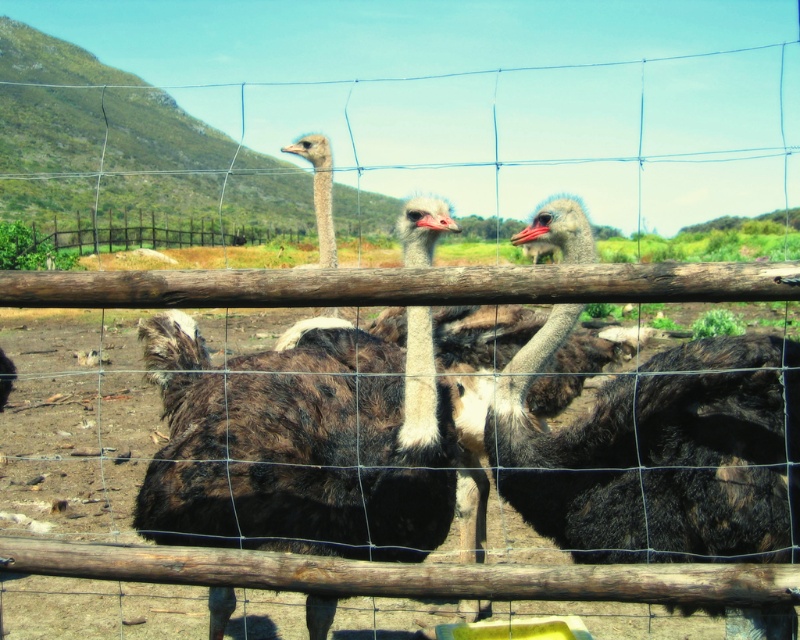
Question: Among these points, which one is nearest to the camera?

Choices:
 (A) (306, 468)
 (B) (516, 458)

Answer: (A)

Question: Can you confirm if dark brown feathered ostrich at center is positioned above dark brown feathers at center?

Choices:
 (A) yes
 (B) no

Answer: (B)

Question: Which point is farther from the camera taking this photo?

Choices:
 (A) pyautogui.click(x=396, y=401)
 (B) pyautogui.click(x=629, y=390)

Answer: (A)

Question: Does dark brown feathered ostrich at center appear over dark brown feathers at center?

Choices:
 (A) no
 (B) yes

Answer: (A)

Question: Is dark brown feathered ostrich at center below dark brown feathers at center?

Choices:
 (A) no
 (B) yes

Answer: (B)

Question: Which point is farther to the camera?

Choices:
 (A) (780, 611)
 (B) (322, 374)

Answer: (B)